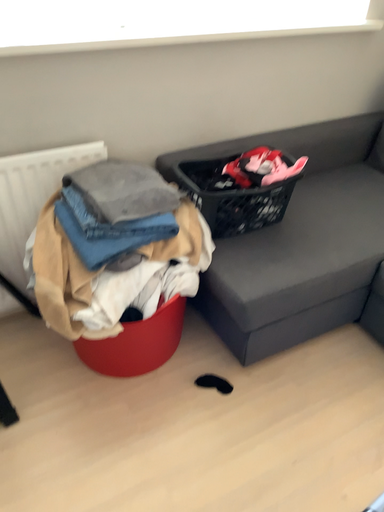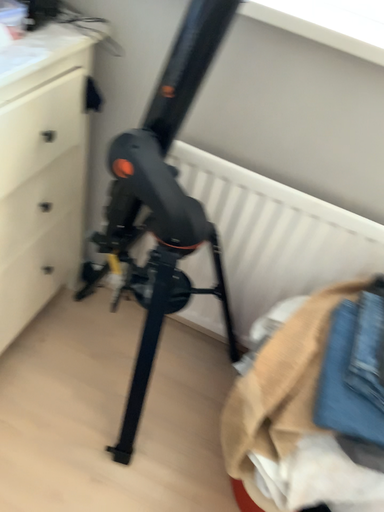
Question: Which way did the camera rotate in the video?

Choices:
 (A) rotated right
 (B) rotated left

Answer: (B)